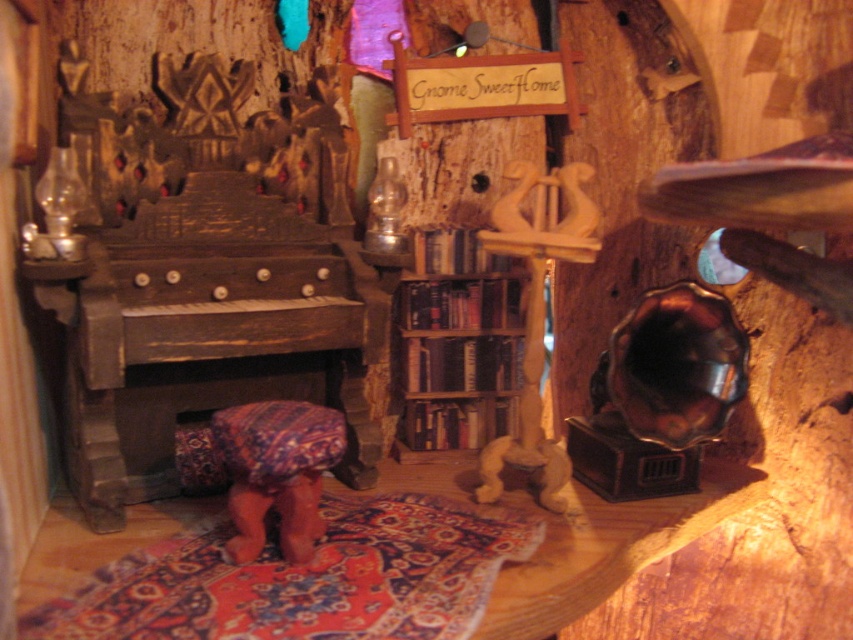
Question: Which of the following is the closest to the observer?

Choices:
 (A) patterned fabric stool at center
 (B) wooden bookshelf at center

Answer: (A)

Question: In this image, where is wooden bookshelf at center located relative to patterned fabric stool at center?

Choices:
 (A) right
 (B) left

Answer: (A)

Question: Does wooden bookshelf at center have a greater width compared to patterned fabric stool at center?

Choices:
 (A) no
 (B) yes

Answer: (B)

Question: Which object appears farthest from the camera in this image?

Choices:
 (A) wooden bookshelf at center
 (B) patterned fabric stool at center

Answer: (A)

Question: Can you confirm if wooden bookshelf at center is thinner than patterned fabric stool at center?

Choices:
 (A) no
 (B) yes

Answer: (A)